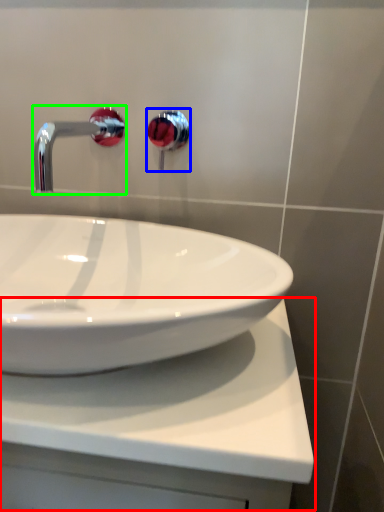
Question: Considering the real-world distances, which object is farthest from counter top (highlighted by a red box)? plumbing fixture (highlighted by a blue box) or tap (highlighted by a green box)?

Choices:
 (A) plumbing fixture
 (B) tap

Answer: (A)